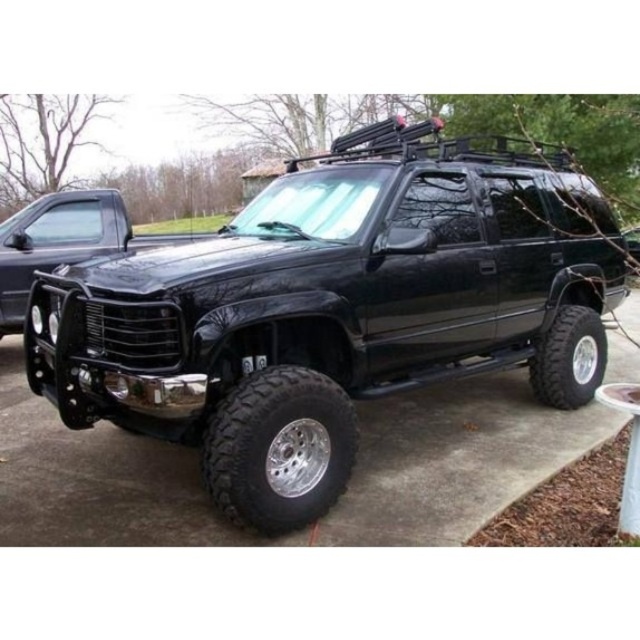
Question: Does black rubber tire at lower left come behind black rubber tire at right?

Choices:
 (A) no
 (B) yes

Answer: (A)

Question: Which point is closer to the camera?

Choices:
 (A) black rubber tire at lower left
 (B) black matte truck at left

Answer: (A)

Question: Does black rubber tire at right appear over black matte suv at center?

Choices:
 (A) no
 (B) yes

Answer: (A)

Question: Which object is farther from the camera taking this photo?

Choices:
 (A) black rubber tire at right
 (B) black matte truck at center
 (C) black matte suv at center

Answer: (C)

Question: Observing the image, what is the correct spatial positioning of black matte truck at left in reference to black matte suv at center?

Choices:
 (A) right
 (B) left

Answer: (B)

Question: Which object is positioned closest to the black matte truck at left?

Choices:
 (A) black rubber tire at right
 (B) black matte truck at center

Answer: (B)